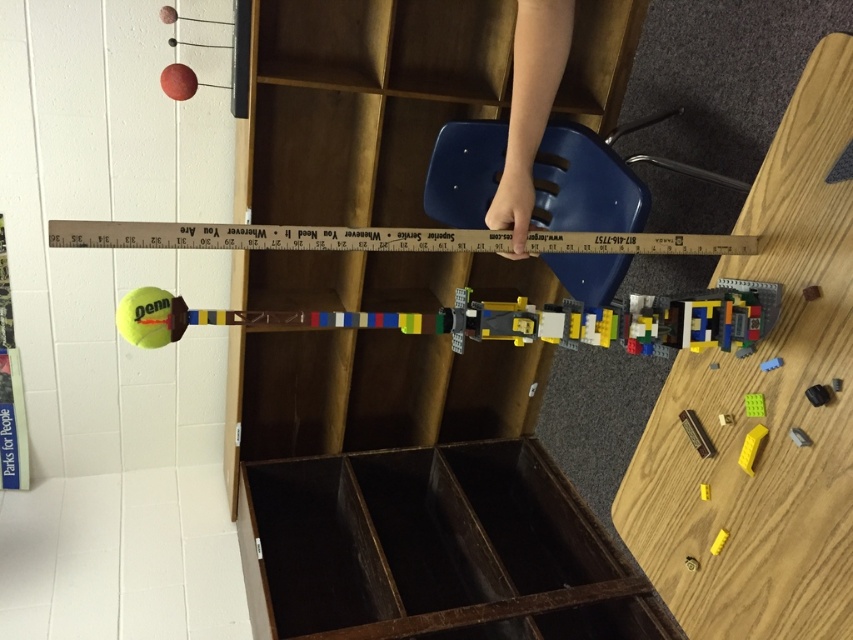
You are trying to place a small sticker on the white plastic ruler at center so it aligns with the yellow rubber tennis ball at lower left. Based on the scene, where should you place the sticker on the ruler?

The white plastic ruler at center is positioned on the right side of the yellow rubber tennis ball at lower left, so you should place the sticker on the left end of the ruler to align with the tennis ball.

You are trying to place a small sticker on the white plastic ruler at center so it can be seen from below. Where should you place the sticker on the ruler to ensure it is visible when looking from the position of the yellow rubber tennis ball at lower left?

Since the white plastic ruler at center is located above the yellow rubber tennis ball at lower left, placing the sticker on the underside of the ruler near its center would make it visible from below, where the tennis ball is positioned.

From the picture: You are trying to place the yellow rubber tennis ball at lower left on the white plastic ruler at center. Will the ball fit entirely on the ruler without hanging off the edges?

The white plastic ruler at center might be wider than yellow rubber tennis ball at lower left, so there is a possibility that the ball will fit, but it is uncertain without exact measurements.